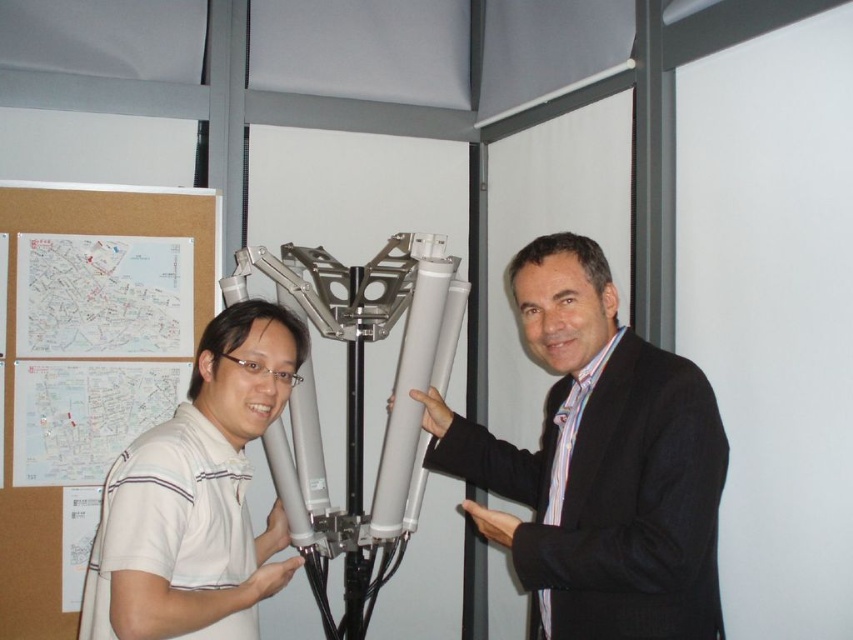
Question: Which point is farther to the camera?

Choices:
 (A) coord(251,340)
 (B) coord(485,516)

Answer: (B)

Question: Which point is farther to the camera?

Choices:
 (A) (596, 499)
 (B) (212, 598)

Answer: (A)

Question: Is matte white cylinder at center closer to camera compared to white striped polo shirt at center?

Choices:
 (A) yes
 (B) no

Answer: (B)

Question: Which of the following is the closest to the observer?

Choices:
 (A) (527, 268)
 (B) (102, 628)

Answer: (B)

Question: Is the position of matte white cylinder at center more distant than that of white striped polo shirt at center?

Choices:
 (A) yes
 (B) no

Answer: (A)

Question: Is matte white cylinder at center positioned before white striped polo shirt at center?

Choices:
 (A) yes
 (B) no

Answer: (B)